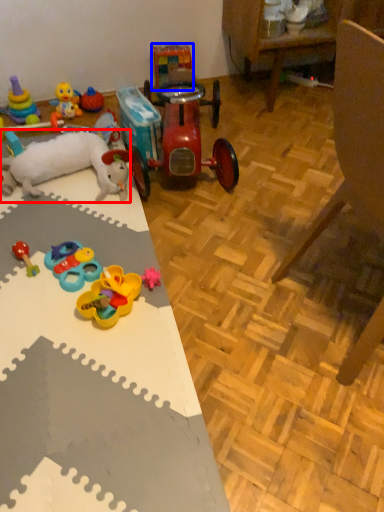
Question: Which point is closer to the camera, toy (highlighted by a red box) or toy (highlighted by a blue box)?

Choices:
 (A) toy
 (B) toy

Answer: (A)